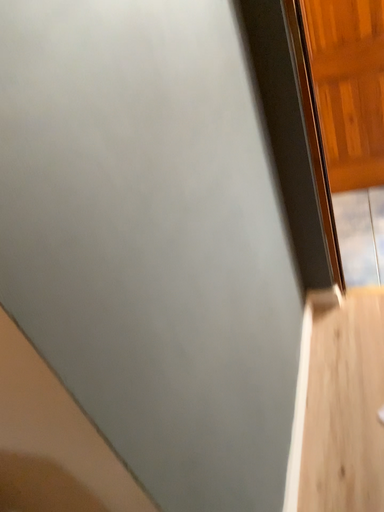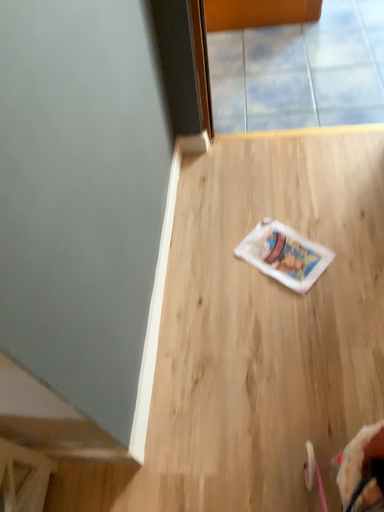
Question: How did the camera likely rotate when shooting the video?

Choices:
 (A) rotated upward
 (B) rotated downward

Answer: (B)